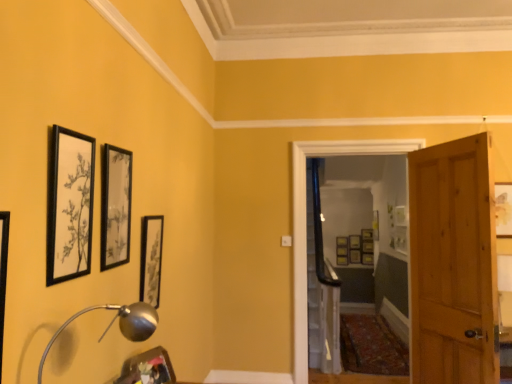
Question: Is matte black picture frame at lower left, the 10th picture frame from the right, smaller than silver metallic table lamp at lower left?

Choices:
 (A) no
 (B) yes

Answer: (B)

Question: Can you confirm if matte black picture frame at lower left, the 10th picture frame from the right, is shorter than silver metallic table lamp at lower left?

Choices:
 (A) yes
 (B) no

Answer: (A)

Question: Does matte black picture frame at lower left, the 11th picture frame positioned from the back, come behind silver metallic table lamp at lower left?

Choices:
 (A) yes
 (B) no

Answer: (A)

Question: From the image's perspective, is matte black picture frame at lower left, placed as the fifth picture frame when sorted from left to right, above silver metallic table lamp at lower left?

Choices:
 (A) yes
 (B) no

Answer: (B)

Question: From a real-world perspective, is matte black picture frame at lower left, the 11th picture frame positioned from the back, below silver metallic table lamp at lower left?

Choices:
 (A) no
 (B) yes

Answer: (B)

Question: Is matte black picture frame at lower left, the 10th picture frame from the right, facing towards silver metallic table lamp at lower left?

Choices:
 (A) yes
 (B) no

Answer: (B)

Question: Is wooden door at right, the 2th door viewed from the back, wider than wooden picture frame at right, which is counted as the ninth picture frame, starting from the left?

Choices:
 (A) no
 (B) yes

Answer: (B)

Question: Does wooden door at right, the 2th door viewed from the back, have a greater height compared to wooden picture frame at right, which is counted as the ninth picture frame, starting from the back?

Choices:
 (A) yes
 (B) no

Answer: (A)

Question: Is wooden door at right, the 2th door viewed from the back, aimed at wooden picture frame at right, the 6th picture frame viewed from the front?

Choices:
 (A) no
 (B) yes

Answer: (B)

Question: Is wooden door at right, placed as the 1th door when sorted from front to back, shorter than wooden picture frame at right, the 6th picture frame viewed from the front?

Choices:
 (A) yes
 (B) no

Answer: (B)

Question: Is wooden door at right, placed as the 1th door when sorted from front to back, bigger than wooden picture frame at right, which is counted as the ninth picture frame, starting from the left?

Choices:
 (A) no
 (B) yes

Answer: (B)

Question: Does wooden door at right, the 2th door viewed from the back, have a smaller size compared to wooden picture frame at right, which is counted as the ninth picture frame, starting from the back?

Choices:
 (A) yes
 (B) no

Answer: (B)

Question: Does silver metallic table lamp at lower left have a greater width compared to wooden picture frame at center, the 9th picture frame in the right-to-left sequence?

Choices:
 (A) no
 (B) yes

Answer: (B)